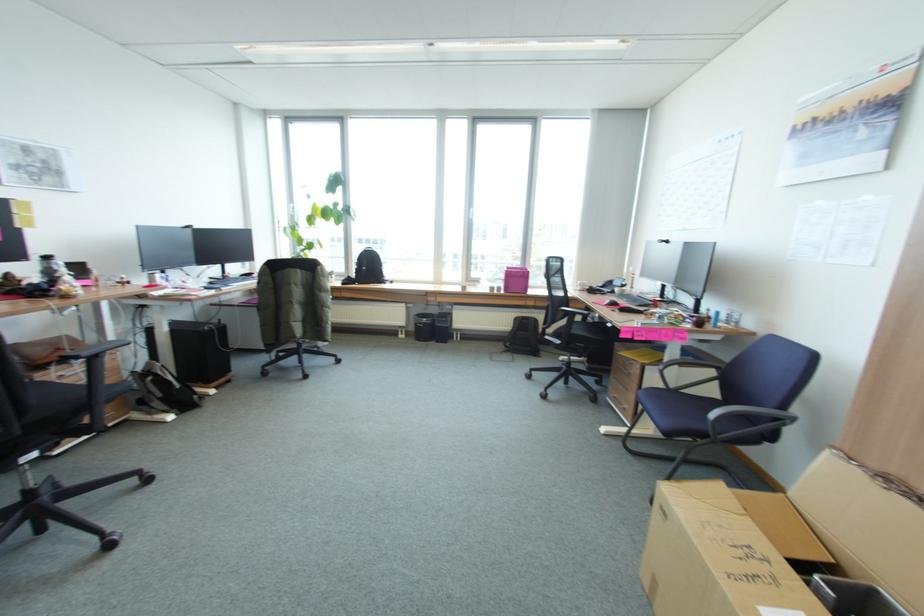
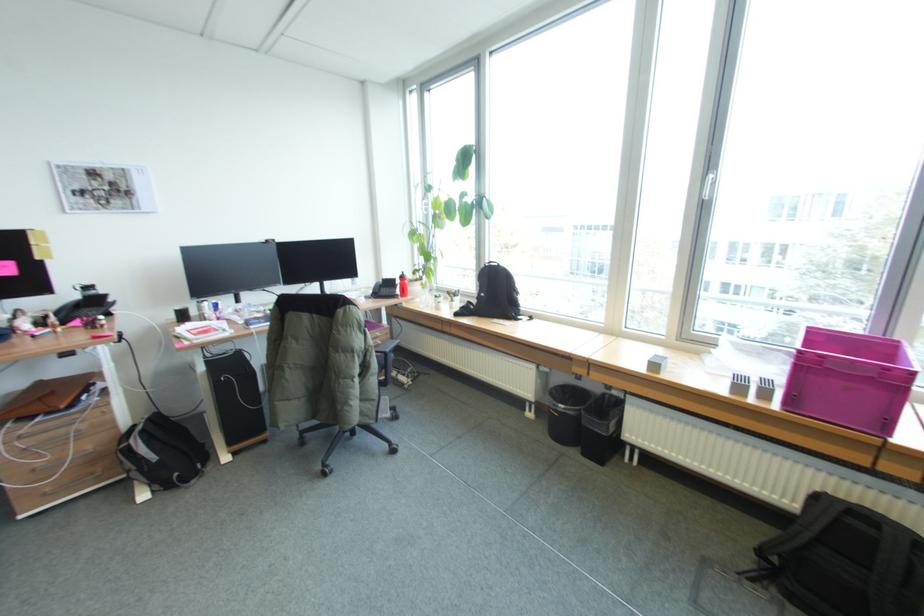
Locate, in the second image, the point that corresponds to the point at 511,270 in the first image.

(803, 350)